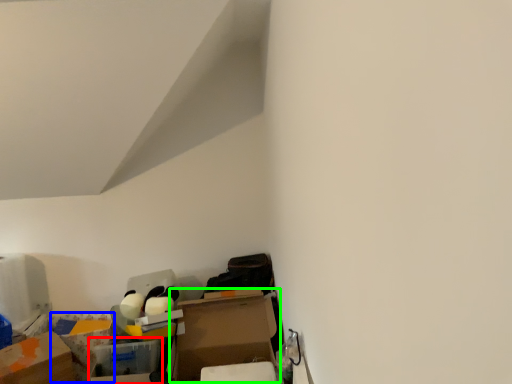
Question: Considering the real-world distances, which object is farthest from storage box (highlighted by a red box)? storage box (highlighted by a blue box) or cardboard box (highlighted by a green box)?

Choices:
 (A) storage box
 (B) cardboard box

Answer: (A)